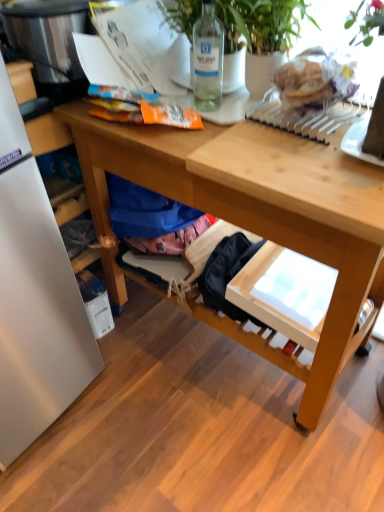
Question: Considering the relative positions of green leafy plant at upper right and clear glass bottle at upper center in the image provided, is green leafy plant at upper right in front of clear glass bottle at upper center?

Choices:
 (A) yes
 (B) no

Answer: (A)

Question: Is green leafy plant at upper right at the left side of clear glass bottle at upper center?

Choices:
 (A) yes
 (B) no

Answer: (B)

Question: Is green leafy plant at upper right behind clear glass bottle at upper center?

Choices:
 (A) yes
 (B) no

Answer: (B)

Question: From a real-world perspective, is green leafy plant at upper right on clear glass bottle at upper center?

Choices:
 (A) yes
 (B) no

Answer: (B)

Question: Is green leafy plant at upper right to the right of clear glass bottle at upper center from the viewer's perspective?

Choices:
 (A) no
 (B) yes

Answer: (B)

Question: Considering their positions, is green leafy plant at upper right located in front of or behind wooden desk at center?

Choices:
 (A) behind
 (B) front

Answer: (A)

Question: Is point (177, 28) positioned closer to the camera than point (349, 269)?

Choices:
 (A) farther
 (B) closer

Answer: (A)

Question: From their relative heights in the image, would you say green leafy plant at upper right is taller or shorter than wooden desk at center?

Choices:
 (A) short
 (B) tall

Answer: (A)

Question: From a real-world perspective, is green leafy plant at upper right positioned above or below wooden desk at center?

Choices:
 (A) below
 (B) above

Answer: (B)

Question: Is clear glass bottle at upper center inside the boundaries of wooden desk at center, or outside?

Choices:
 (A) inside
 (B) outside

Answer: (B)

Question: Is point (221, 58) positioned closer to the camera than point (125, 130)?

Choices:
 (A) closer
 (B) farther

Answer: (B)

Question: From the image's perspective, is clear glass bottle at upper center above or below wooden desk at center?

Choices:
 (A) above
 (B) below

Answer: (A)

Question: Relative to wooden desk at center, is clear glass bottle at upper center in front or behind?

Choices:
 (A) behind
 (B) front

Answer: (A)

Question: From the image's perspective, is clear glass bottle at upper center located above or below stainless steel appliance at left?

Choices:
 (A) above
 (B) below

Answer: (B)

Question: Choose the correct answer: Is clear glass bottle at upper center inside stainless steel appliance at left or outside it?

Choices:
 (A) outside
 (B) inside

Answer: (A)